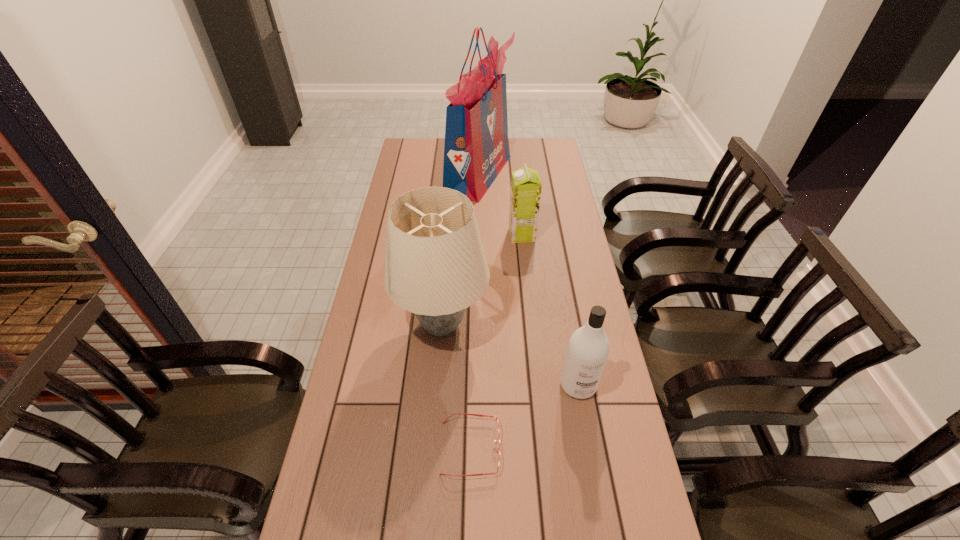
Identify the location of vacant space that satisfies the following two spatial constraints: 1. on the front-facing side of the shampoo; 2. on the lenses of the nearest object. (589, 448).